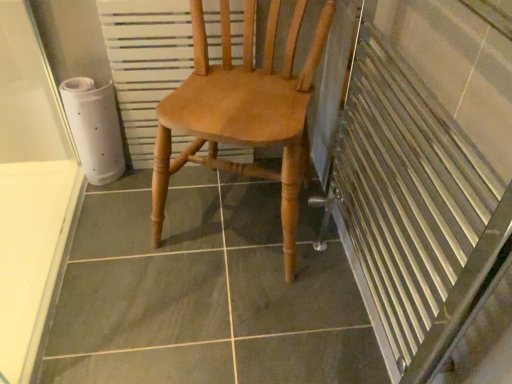
You are a GUI agent. You are given a task and a screenshot of the screen. Output one action in this format:
    pyautogui.click(x=<x>, y=<y>)
    Task: Click on the free space between light brown wood chair at center and white textured radiator at center
    The height and width of the screenshot is (384, 512).
    Given the screenshot: What is the action you would take?
    pyautogui.click(x=143, y=196)